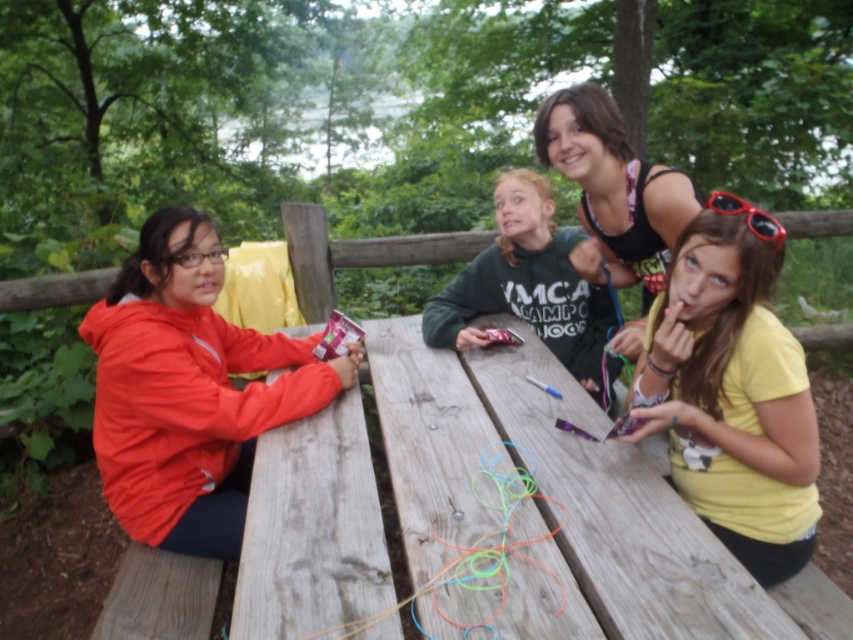
Question: Is matte orange jacket at left to the right of neon rubber bands at center from the viewer's perspective?

Choices:
 (A) no
 (B) yes

Answer: (A)

Question: Does matte orange jacket at left have a smaller size compared to green fleece sweatshirt at center?

Choices:
 (A) yes
 (B) no

Answer: (B)

Question: Which of the following is the farthest from the observer?

Choices:
 (A) (486, 458)
 (B) (640, 198)
 (C) (461, 348)

Answer: (C)

Question: Among these points, which one is nearest to the camera?

Choices:
 (A) (520, 216)
 (B) (648, 356)
 (C) (155, 468)
 (D) (695, 596)

Answer: (D)

Question: Does matte orange jacket at left lie behind neon rubber bands at center?

Choices:
 (A) no
 (B) yes

Answer: (B)

Question: Which object is closer to the camera taking this photo?

Choices:
 (A) wooden picnic table at center
 (B) green fleece sweatshirt at center
 (C) neon rubber bands at center

Answer: (A)